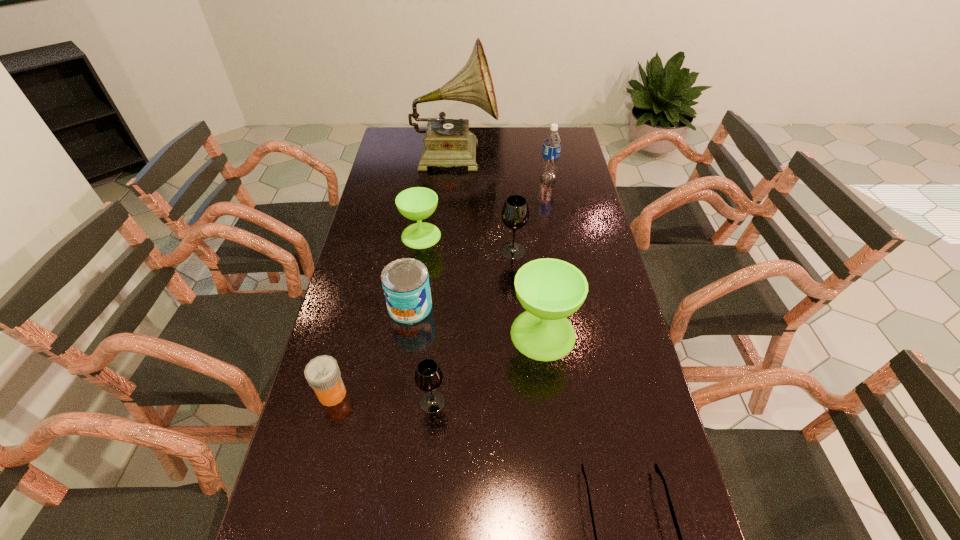
In the image, there is a desktop. At what (x,y) coordinates should I click in order to perform the action: click on vacant space at the far edge. Please return your answer as a coordinate pair (x, y). Looking at the image, I should click on (x=502, y=148).

In the image, there is a desktop. Where is `free region at the left edge`? free region at the left edge is located at coordinates (356, 345).

In the image, there is a desktop. Where is `vacant space at the right edge`? This screenshot has height=540, width=960. vacant space at the right edge is located at coordinates (564, 243).

In the image, there is a desktop. Identify the location of vacant space at the far left corner. (410, 129).

Where is `vacant area that lies between the bigger gray wineglass and the smaller gray wineglass`? vacant area that lies between the bigger gray wineglass and the smaller gray wineglass is located at coordinates (472, 326).

Where is `vacant region between the smaller green wineglass and the water bottle`? vacant region between the smaller green wineglass and the water bottle is located at coordinates [x=485, y=207].

Locate an element on the screen. This screenshot has height=540, width=960. vacant space that is in between the eighth nearest object and the smaller green wineglass is located at coordinates (485, 207).

Where is `vacant region between the water bottle and the farther green wineglass`? The width and height of the screenshot is (960, 540). vacant region between the water bottle and the farther green wineglass is located at coordinates (485, 207).

This screenshot has width=960, height=540. I want to click on free space between the second nearest wineglass and the left green wineglass, so click(482, 285).

Locate an element on the screen. The image size is (960, 540). object identified as the seventh closest to the can is located at coordinates (448, 142).